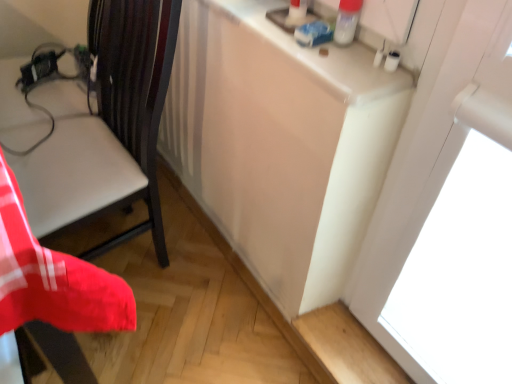
Question: Is point (348, 46) positioned closer to the camera than point (115, 91)?

Choices:
 (A) closer
 (B) farther

Answer: (A)

Question: From the image's perspective, is white glossy counter top at upper right above or below matte black chair at left?

Choices:
 (A) above
 (B) below

Answer: (A)

Question: From a real-world perspective, is white glossy counter top at upper right above or below matte black chair at left?

Choices:
 (A) below
 (B) above

Answer: (B)

Question: Does point (37, 210) appear closer or farther from the camera than point (295, 49)?

Choices:
 (A) closer
 (B) farther

Answer: (B)

Question: From the image's perspective, is matte black chair at left positioned above or below white glossy counter top at upper right?

Choices:
 (A) above
 (B) below

Answer: (B)

Question: In terms of size, does matte black chair at left appear bigger or smaller than white glossy counter top at upper right?

Choices:
 (A) small
 (B) big

Answer: (B)

Question: Is matte black chair at left taller or shorter than white glossy counter top at upper right?

Choices:
 (A) short
 (B) tall

Answer: (B)